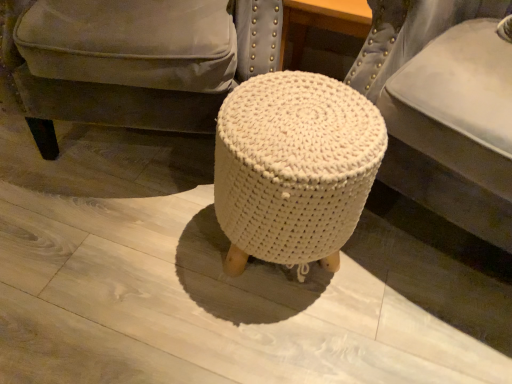
Question: Considering the positions of white knitted pouf at center and white knitted stool at center in the image, is white knitted pouf at center wider or thinner than white knitted stool at center?

Choices:
 (A) thin
 (B) wide

Answer: (B)

Question: In terms of height, does white knitted pouf at center look taller or shorter compared to white knitted stool at center?

Choices:
 (A) short
 (B) tall

Answer: (B)

Question: Considering the real-world distances, which object is closest to the white knitted stool at center?

Choices:
 (A) white knitted pouf at center
 (B) white knitted stool at center

Answer: (B)

Question: Which object is positioned closest to the white knitted pouf at center?

Choices:
 (A) white knitted stool at center
 (B) white knitted stool at center

Answer: (B)